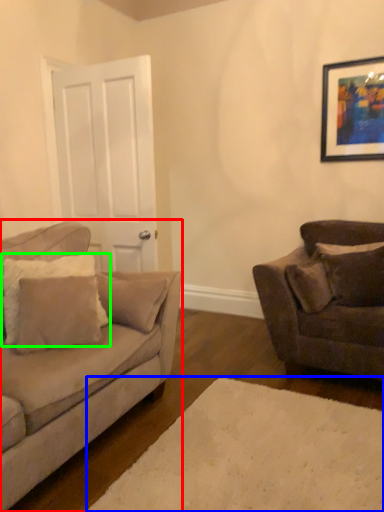
Question: Which is farther away from studio couch (highlighted by a red box)? plain (highlighted by a blue box) or pillow (highlighted by a green box)?

Choices:
 (A) plain
 (B) pillow

Answer: (A)